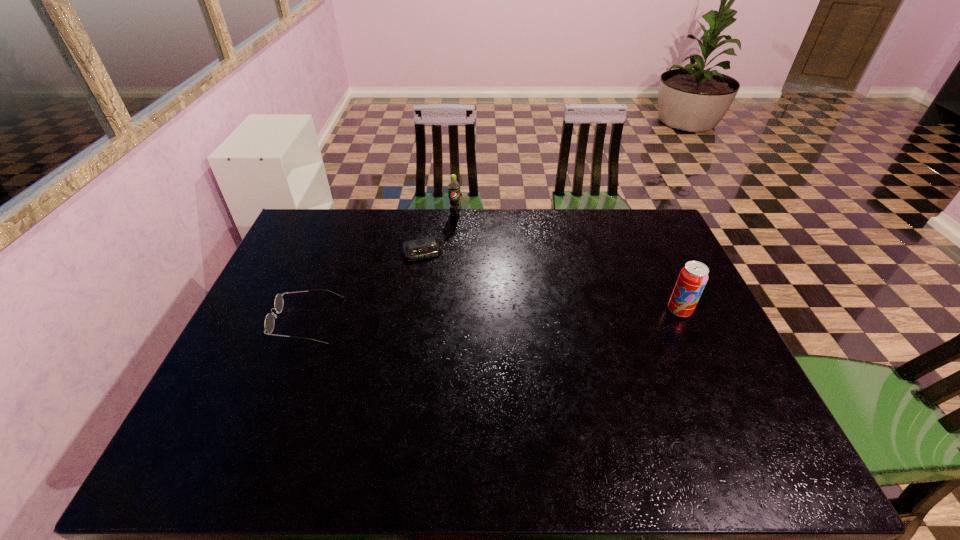
Image resolution: width=960 pixels, height=540 pixels. In order to click on vacant space situated 0.050m on the display of the third object from right to left in this screenshot , I will do `click(429, 272)`.

The image size is (960, 540). In order to click on free spot located 0.380m on the display of the third object from right to left in this screenshot , I will do `click(455, 354)`.

Find the location of a particular element. Image resolution: width=960 pixels, height=540 pixels. vacant space situated on the front label of the farther soda is located at coordinates (452, 254).

This screenshot has width=960, height=540. What are the coordinates of `blank space located 0.310m on the front label of the farther soda` in the screenshot? It's located at (451, 275).

At what (x,y) coordinates should I click in order to perform the action: click on vacant space located on the front label of the farther soda. Please return your answer as a coordinate pair (x, y). The image size is (960, 540). Looking at the image, I should click on (450, 296).

You are a GUI agent. You are given a task and a screenshot of the screen. Output one action in this format:
    pyautogui.click(x=<x>, y=<y>)
    Task: Click on the alarm clock at the far edge
    
    Given the screenshot: What is the action you would take?
    pyautogui.click(x=423, y=248)

In order to click on soda at the far edge in this screenshot , I will do `click(453, 187)`.

Where is `object located at the left edge`? This screenshot has width=960, height=540. object located at the left edge is located at coordinates (269, 323).

In order to click on object that is at the right edge in this screenshot , I will do `click(693, 277)`.

Find the location of a particular element. The width and height of the screenshot is (960, 540). vacant space at the far edge of the desktop is located at coordinates (605, 234).